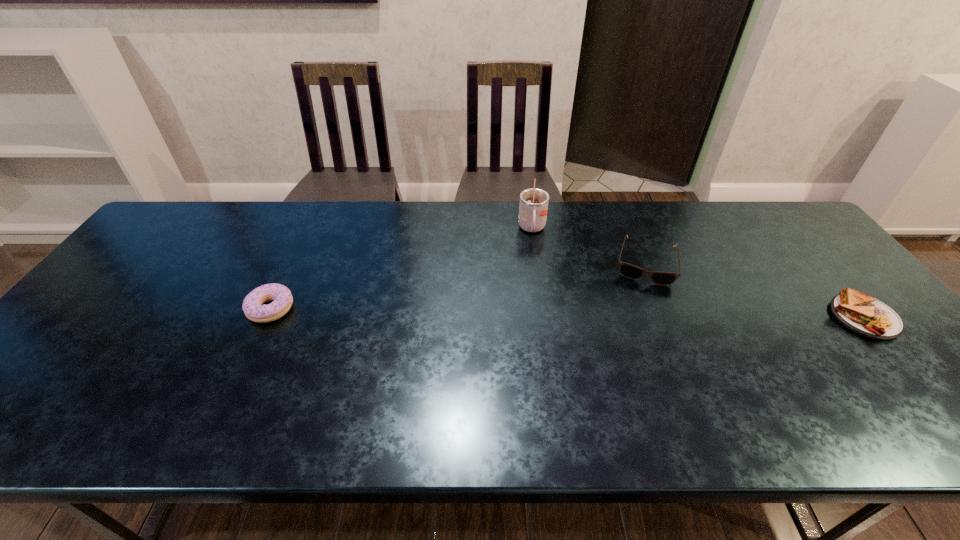
Identify the location of vacant space on the desktop that is between the leftmost object and the sandwich and is positioned on the side with the handle of the second object from left to right. The height and width of the screenshot is (540, 960). (536, 313).

Identify the location of free spot on the desktop that is between the leftmost object and the rightmost object and is positioned on the lenses of the sunglasses. This screenshot has width=960, height=540. (639, 314).